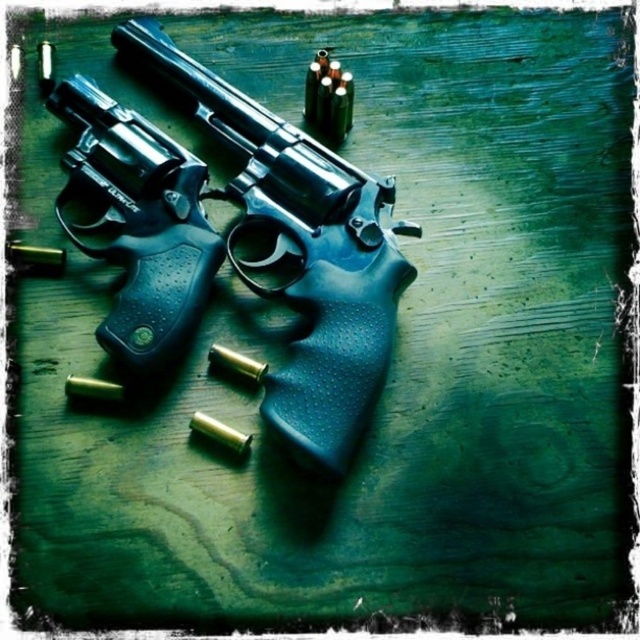
Question: Does polished metal revolver at center come behind matte black revolver at center?

Choices:
 (A) yes
 (B) no

Answer: (B)

Question: Which of the following is the closest to the observer?

Choices:
 (A) (182, 288)
 (B) (387, 344)

Answer: (B)

Question: Is polished metal revolver at center smaller than matte black revolver at center?

Choices:
 (A) yes
 (B) no

Answer: (B)

Question: Does polished metal revolver at center have a lesser width compared to matte black revolver at center?

Choices:
 (A) no
 (B) yes

Answer: (A)